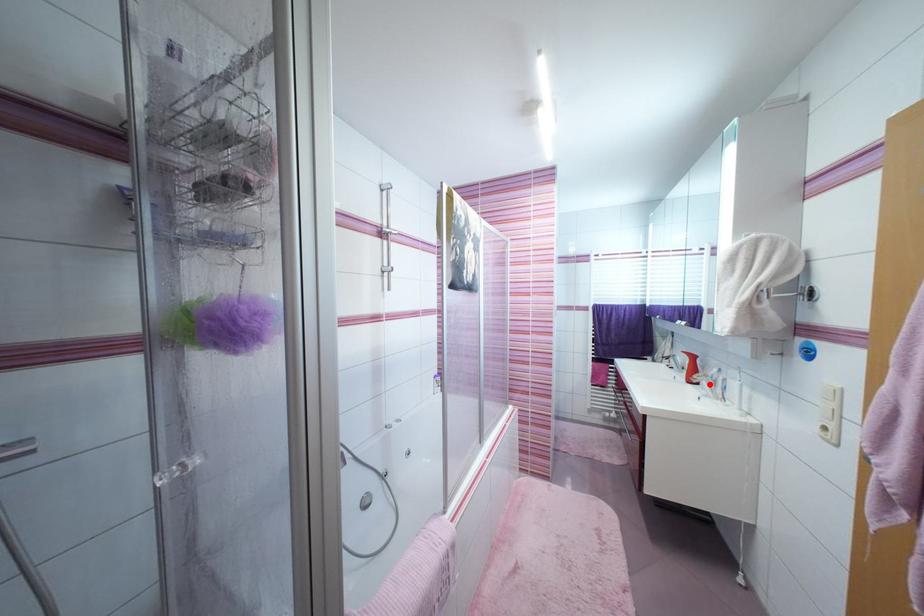
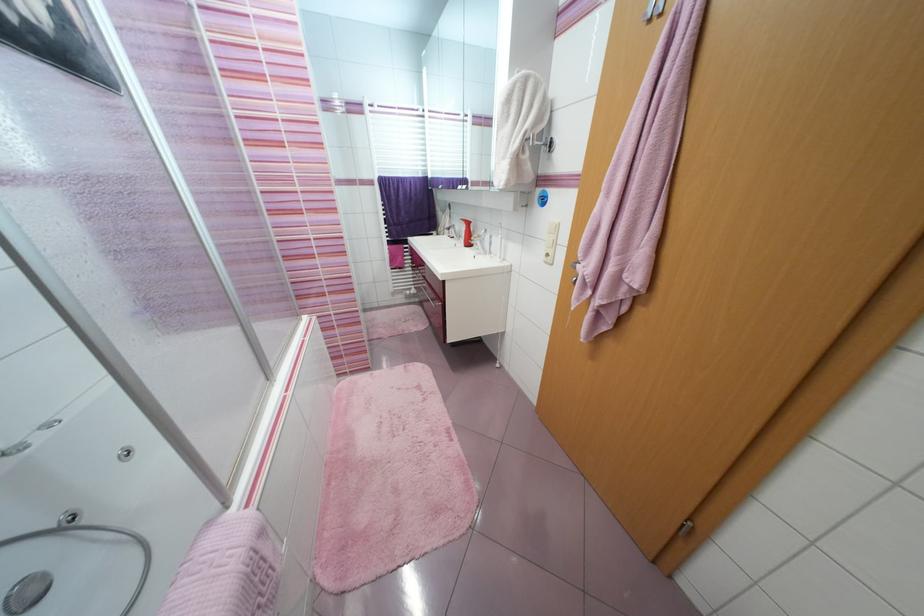
Find the pixel in the second image that matches the highlighted location in the first image.

(483, 244)